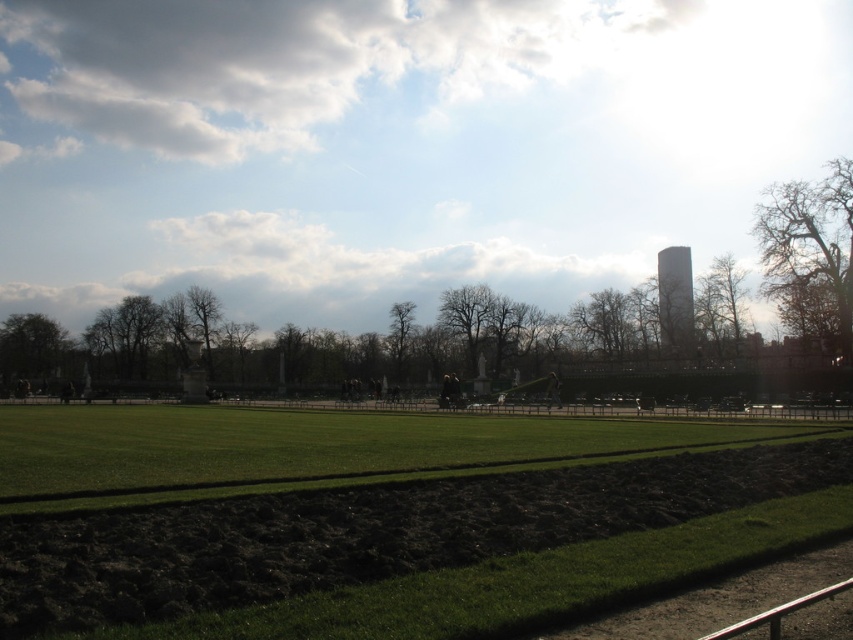
Is bare branches at upper right closer to camera compared to green leafy tree at left?

Yes, bare branches at upper right is in front of green leafy tree at left.

Between bare branches at upper right and green leafy tree at left, which one has less height?

A: With less height is green leafy tree at left.

Between point (843, 177) and point (30, 332), which one is positioned in front?

Point (843, 177)

Where is `bare branches at upper right`? This screenshot has width=853, height=640. bare branches at upper right is located at coordinates (810, 248).

Between metallic silver rail at lower right and bare branches at center, which one has more height?

bare branches at center is taller.

Can you confirm if metallic silver rail at lower right is positioned to the left of bare branches at center?

In fact, metallic silver rail at lower right is to the right of bare branches at center.

Locate an element on the screen. metallic silver rail at lower right is located at coordinates coord(778,612).

The image size is (853, 640). What do you see at coordinates (810, 248) in the screenshot? I see `bare branches at upper right` at bounding box center [810, 248].

What do you see at coordinates (810, 248) in the screenshot?
I see `bare branches at upper right` at bounding box center [810, 248].

This screenshot has height=640, width=853. Identify the location of bare branches at upper right. (810, 248).